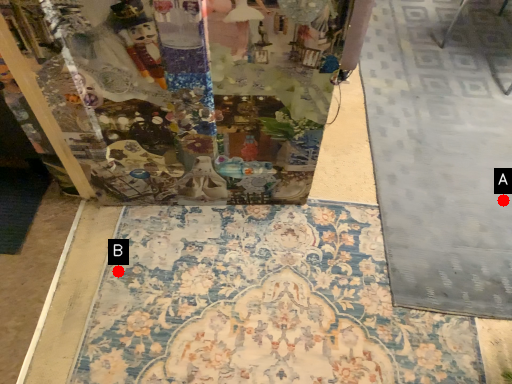
Question: Two points are circled on the image, labeled by A and B beside each circle. Which point is closer to the camera?

Choices:
 (A) A is closer
 (B) B is closer

Answer: (B)